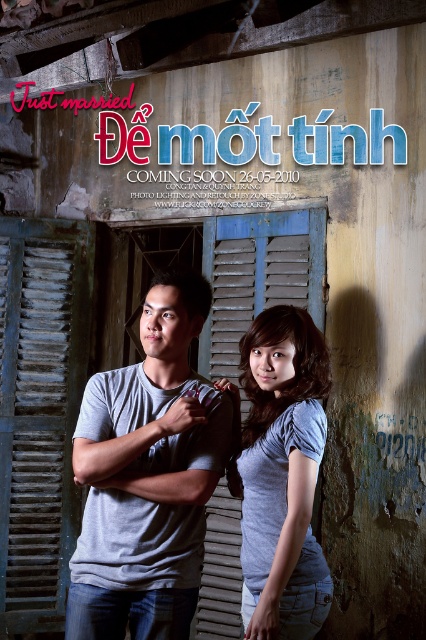
Does gray cotton t-shirt at center lie behind light blue fabric shirt at center?

That is True.

Describe the element at coordinates (147, 476) in the screenshot. This screenshot has height=640, width=426. I see `gray cotton t-shirt at center` at that location.

Which is in front, point (206, 483) or point (290, 545)?

Point (290, 545) is more forward.

Where is `gray cotton t-shirt at center`? The height and width of the screenshot is (640, 426). gray cotton t-shirt at center is located at coordinates (147, 476).